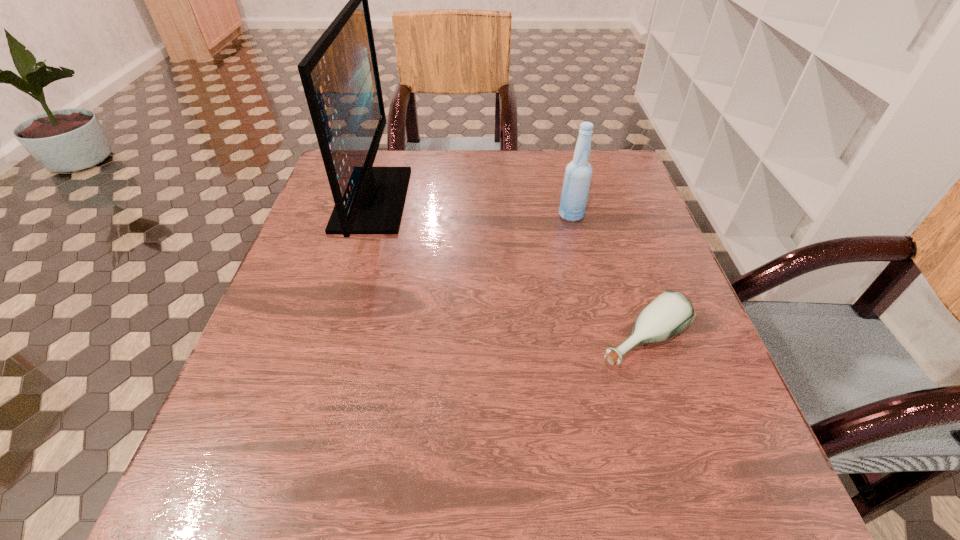
Locate an element on the screen. the leftmost object is located at coordinates (340, 77).

Find the location of a particular element. the tallest object is located at coordinates (340, 77).

Image resolution: width=960 pixels, height=540 pixels. I want to click on the farther bottle, so click(578, 173).

I want to click on the second tallest object, so click(578, 173).

This screenshot has width=960, height=540. Identify the location of the shortest object. (671, 312).

This screenshot has height=540, width=960. Find the location of `the shorter bottle`. the shorter bottle is located at coordinates (671, 312).

Find the location of a particular element. This screenshot has height=540, width=960. vacant space located 0.120m on the screen side of the monitor is located at coordinates click(x=452, y=199).

This screenshot has width=960, height=540. I want to click on vacant position located on the right of the taller bottle, so click(x=605, y=215).

Find the location of `vacant area situated 0.230m on the front of the nearest object`. vacant area situated 0.230m on the front of the nearest object is located at coordinates tap(701, 524).

I want to click on object that is at the far edge, so [340, 77].